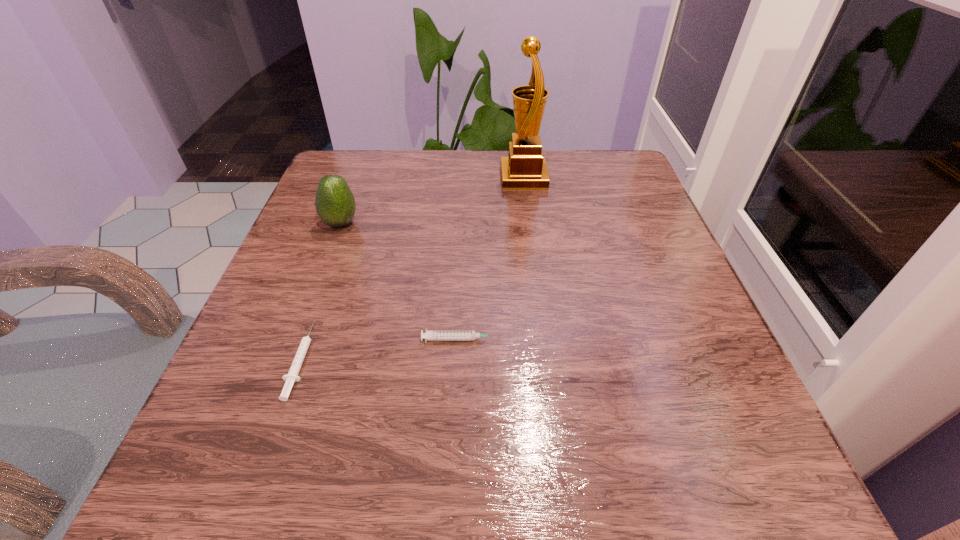
Locate an element on the screen. vacant space at the far right corner of the desktop is located at coordinates (590, 183).

What are the coordinates of `vacant space at the near right corner of the desktop` in the screenshot? It's located at (683, 503).

Identify the location of vacant area that lies between the tallest object and the left syringe. coord(412,268).

This screenshot has height=540, width=960. What are the coordinates of `free space between the second tallest object and the taller syringe` in the screenshot? It's located at click(401, 281).

Locate an element on the screen. This screenshot has width=960, height=540. free space between the tallest object and the shortest object is located at coordinates (412, 268).

Identify the location of vacant area between the award and the third tallest object. This screenshot has width=960, height=540. (492, 258).

What are the coordinates of `vacant point located between the taller syringe and the rightmost object` in the screenshot? It's located at (492, 258).

Locate an element on the screen. Image resolution: width=960 pixels, height=540 pixels. free space between the taller syringe and the shortest object is located at coordinates (381, 349).

At what (x,y) coordinates should I click in order to perform the action: click on free space between the shortest object and the farthest object. Please return your answer as a coordinate pair (x, y). The width and height of the screenshot is (960, 540). Looking at the image, I should click on (412, 268).

The height and width of the screenshot is (540, 960). Identify the location of blank region between the third object from left to right and the tallest object. (492, 258).